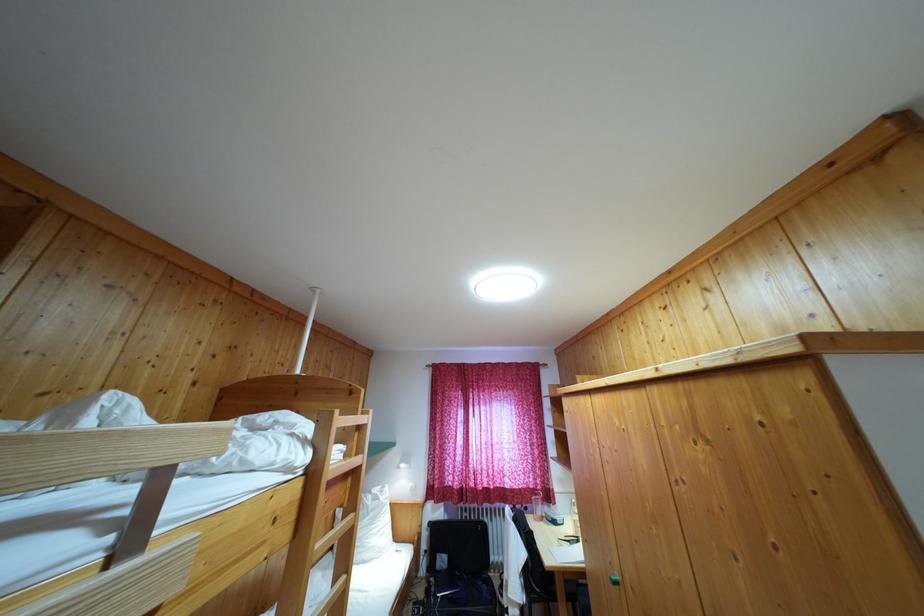
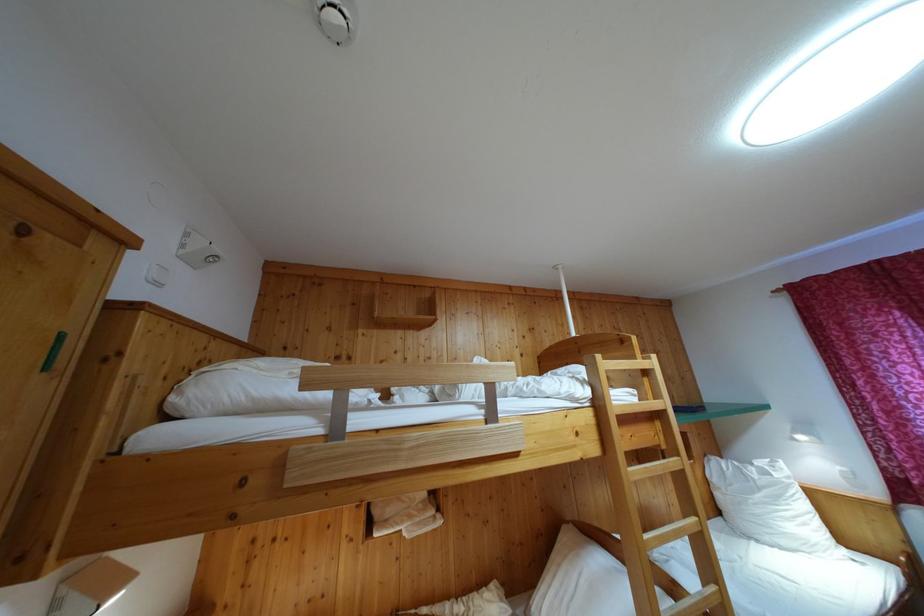
Find the pixel in the second image that matches pixel 373 499 in the first image.

(755, 471)